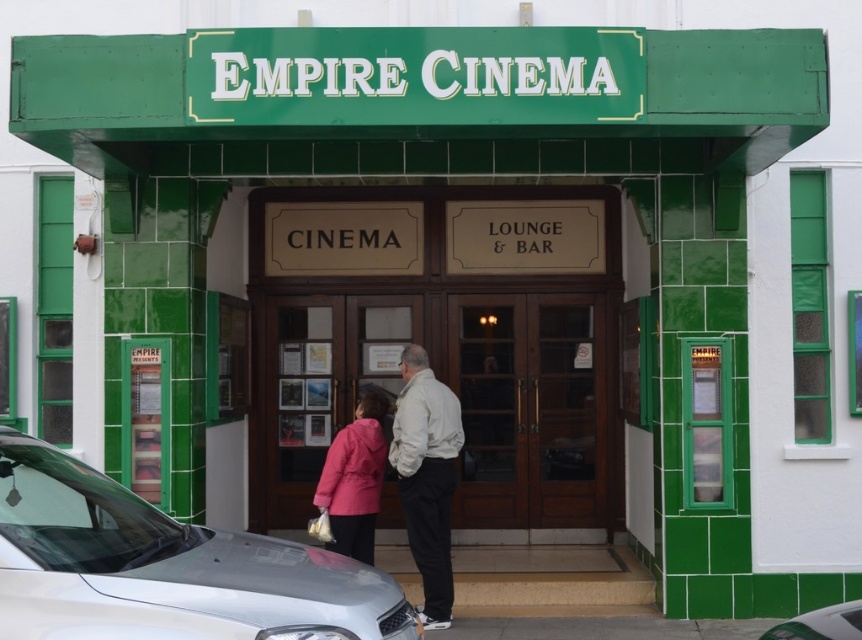
Question: Considering the real-world distances, which object is farthest from the pink fabric coat at center?

Choices:
 (A) brown wooden door at center
 (B) wooden doors at center
 (C) white matte jacket at center
 (D) silver metallic car at lower left

Answer: (D)

Question: Where is brown wooden door at center located in relation to pink fabric coat at center in the image?

Choices:
 (A) left
 (B) right

Answer: (B)

Question: Considering the relative positions of silver metallic car at lower left and silver metallic car at lower right in the image provided, where is silver metallic car at lower left located with respect to silver metallic car at lower right?

Choices:
 (A) above
 (B) below

Answer: (A)

Question: Does silver metallic car at lower left have a lesser width compared to brown wooden door at center?

Choices:
 (A) yes
 (B) no

Answer: (B)

Question: Which point is farther to the camera?

Choices:
 (A) wooden doors at center
 (B) brown wooden door at center

Answer: (B)

Question: Which of the following is the farthest from the observer?

Choices:
 (A) silver metallic car at lower right
 (B) wooden doors at center
 (C) silver metallic car at lower left
 (D) white matte jacket at center

Answer: (B)